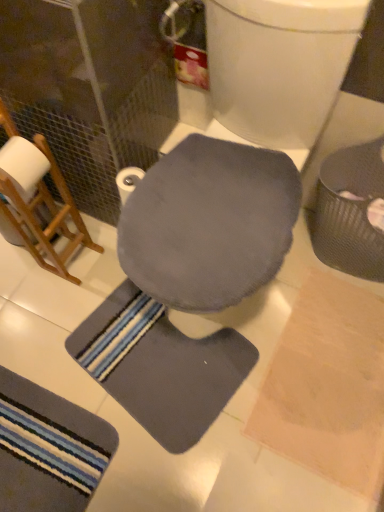
The height and width of the screenshot is (512, 384). What do you see at coordinates (111, 303) in the screenshot? I see `gray soft mat at center, which is the second bath mat from left to right` at bounding box center [111, 303].

What do you see at coordinates (49, 449) in the screenshot?
I see `striped fabric bath mat at lower left, acting as the first bath mat starting from the left` at bounding box center [49, 449].

Image resolution: width=384 pixels, height=512 pixels. Identify the location of gray soft mat at center, acting as the first bath mat starting from the right. (111, 303).

From a real-world perspective, relative to white matte toilet paper at center, is striped fabric bath mat at lower left, positioned as the second bath mat in right-to-left order, vertically above or below?

striped fabric bath mat at lower left, positioned as the second bath mat in right-to-left order, is situated lower than white matte toilet paper at center in the real world.

Does striped fabric bath mat at lower left, acting as the first bath mat starting from the left, appear on the right side of white matte toilet paper at center?

No, striped fabric bath mat at lower left, acting as the first bath mat starting from the left, is not to the right of white matte toilet paper at center.

In terms of width, does striped fabric bath mat at lower left, acting as the first bath mat starting from the left, look wider or thinner when compared to white matte toilet paper at center?

striped fabric bath mat at lower left, acting as the first bath mat starting from the left, is wider than white matte toilet paper at center.

Could you tell me if striped fabric bath mat at lower left, acting as the first bath mat starting from the left, is turned towards white matte toilet paper at center?

No, striped fabric bath mat at lower left, acting as the first bath mat starting from the left, is not oriented towards white matte toilet paper at center.

Does point (113, 389) come in front of point (122, 177)?

No, (113, 389) is further to viewer.

Does gray soft mat at center, which is the second bath mat from left to right, appear on the right side of white matte toilet paper at center?

Indeed, gray soft mat at center, which is the second bath mat from left to right, is positioned on the right side of white matte toilet paper at center.

Between gray soft mat at center, which is the second bath mat from left to right, and white matte toilet paper at center, which one is positioned in front?

white matte toilet paper at center is in front.

Is gray soft mat at center, which is the second bath mat from left to right, not near white matte toilet paper at center?

No, there isn't a large distance between gray soft mat at center, which is the second bath mat from left to right, and white matte toilet paper at center.

Relative to gray soft mat at center, acting as the first bath mat starting from the right, is striped fabric bath mat at lower left, acting as the first bath mat starting from the left, in front or behind?

In the image, striped fabric bath mat at lower left, acting as the first bath mat starting from the left, appears in front of gray soft mat at center, acting as the first bath mat starting from the right.

Is point (94, 474) farther from camera compared to point (158, 321)?

That is False.

Which is more to the left, striped fabric bath mat at lower left, acting as the first bath mat starting from the left, or gray soft mat at center, acting as the first bath mat starting from the right?

Positioned to the left is striped fabric bath mat at lower left, acting as the first bath mat starting from the left.

Looking at this image, from a real-world perspective, is striped fabric bath mat at lower left, positioned as the second bath mat in right-to-left order, above or below gray soft mat at center, which is the second bath mat from left to right?

In terms of real-world spatial position, striped fabric bath mat at lower left, positioned as the second bath mat in right-to-left order, is above gray soft mat at center, which is the second bath mat from left to right.

Is white matte toilet paper at center not inside matte gray swivel chair at center?

Absolutely, white matte toilet paper at center is external to matte gray swivel chair at center.

Considering the relative sizes of white matte toilet paper at center and matte gray swivel chair at center in the image provided, is white matte toilet paper at center wider than matte gray swivel chair at center?

Incorrect, the width of white matte toilet paper at center does not surpass that of matte gray swivel chair at center.

From a real-world perspective, between white matte toilet paper at center and matte gray swivel chair at center, who is vertically higher?

In real-world perspective, matte gray swivel chair at center is above.

What's the angular difference between white matte toilet paper at center and matte gray swivel chair at center's facing directions?

0.00062 degrees.

Considering the relative positions of matte gray swivel chair at center and gray soft mat at center, acting as the first bath mat starting from the right, in the image provided, is matte gray swivel chair at center to the right of gray soft mat at center, acting as the first bath mat starting from the right, from the viewer's perspective?

Indeed, matte gray swivel chair at center is positioned on the right side of gray soft mat at center, acting as the first bath mat starting from the right.

Is matte gray swivel chair at center looking in the opposite direction of gray soft mat at center, which is the second bath mat from left to right?

No, gray soft mat at center, which is the second bath mat from left to right, is not at the back of matte gray swivel chair at center.

How different are the orientations of matte gray swivel chair at center and gray soft mat at center, which is the second bath mat from left to right, in degrees?

17 degrees.

Looking at this image, is matte gray swivel chair at center positioned far away from gray soft mat at center, acting as the first bath mat starting from the right?

No, there isn't a large distance between matte gray swivel chair at center and gray soft mat at center, acting as the first bath mat starting from the right.

From a real-world perspective, which object rests below the other?

metallic textured trash can at right.

Is metallic textured trash can at right looking in the opposite direction of matte gray swivel chair at center?

No, metallic textured trash can at right is not facing the opposite direction of matte gray swivel chair at center.

Is point (360, 155) in front of point (226, 284)?

No, it is not.

Considering the relative positions of metallic textured trash can at right and matte gray swivel chair at center in the image provided, is metallic textured trash can at right behind matte gray swivel chair at center?

Yes, it is behind matte gray swivel chair at center.

Is metallic textured trash can at right inside the boundaries of gray soft mat at center, which is the second bath mat from left to right, or outside?

metallic textured trash can at right cannot be found inside gray soft mat at center, which is the second bath mat from left to right.

Is metallic textured trash can at right looking in the opposite direction of gray soft mat at center, acting as the first bath mat starting from the right?

No, metallic textured trash can at right is not facing the opposite direction of gray soft mat at center, acting as the first bath mat starting from the right.

In the image, is metallic textured trash can at right on the left side or the right side of gray soft mat at center, acting as the first bath mat starting from the right?

metallic textured trash can at right is positioned on gray soft mat at center, acting as the first bath mat starting from the right,'s right side.

From the image's perspective, between metallic textured trash can at right and gray soft mat at center, acting as the first bath mat starting from the right, who is located below?

gray soft mat at center, acting as the first bath mat starting from the right, is shown below in the image.

This screenshot has width=384, height=512. Find the location of `toilet paper above the striped fabric bath mat at lower left, acting as the first bath mat starting from the left (from the image's perspective)`. toilet paper above the striped fabric bath mat at lower left, acting as the first bath mat starting from the left (from the image's perspective) is located at coordinates (128, 181).

Find the location of a particular element. toilet paper above the gray soft mat at center, acting as the first bath mat starting from the right (from a real-world perspective) is located at coordinates (128, 181).

Looking at the image, which one is located further to white matte toilet paper at center, matte gray swivel chair at center or metallic textured trash can at right?

Among the two, metallic textured trash can at right is located further to white matte toilet paper at center.

Based on their spatial positions, is striped fabric bath mat at lower left, acting as the first bath mat starting from the left, or white matte toilet paper at center closer to gray soft mat at center, acting as the first bath mat starting from the right?

striped fabric bath mat at lower left, acting as the first bath mat starting from the left, lies closer to gray soft mat at center, acting as the first bath mat starting from the right, than the other object.

Based on their spatial positions, is matte gray swivel chair at center or gray soft mat at center, acting as the first bath mat starting from the right, further from striped fabric bath mat at lower left, acting as the first bath mat starting from the left?

Based on the image, matte gray swivel chair at center appears to be further to striped fabric bath mat at lower left, acting as the first bath mat starting from the left.

Which object lies nearer to the anchor point striped fabric bath mat at lower left, positioned as the second bath mat in right-to-left order, white matte toilet paper at center or gray soft mat at center, acting as the first bath mat starting from the right?

gray soft mat at center, acting as the first bath mat starting from the right.

Based on their spatial positions, is matte gray swivel chair at center or gray soft mat at center, which is the second bath mat from left to right, further from metallic textured trash can at right?

The object further to metallic textured trash can at right is gray soft mat at center, which is the second bath mat from left to right.

Considering their positions, is white matte toilet paper at center positioned further to gray soft mat at center, acting as the first bath mat starting from the right, than metallic textured trash can at right?

metallic textured trash can at right is positioned further to the anchor gray soft mat at center, acting as the first bath mat starting from the right.

When comparing their distances from white matte toilet paper at center, does metallic textured trash can at right or matte gray swivel chair at center seem closer?

Among the two, matte gray swivel chair at center is located nearer to white matte toilet paper at center.

When comparing their distances from white matte toilet paper at center, does gray soft mat at center, which is the second bath mat from left to right, or matte gray swivel chair at center seem further?

gray soft mat at center, which is the second bath mat from left to right.

Identify the location of swivel chair between white matte toilet paper at center and gray soft mat at center, acting as the first bath mat starting from the right, in the vertical direction. (209, 223).

Image resolution: width=384 pixels, height=512 pixels. Identify the location of swivel chair situated between white matte toilet paper at center and metallic textured trash can at right from left to right. (209, 223).

Locate an element on the screen. This screenshot has width=384, height=512. toilet paper between striped fabric bath mat at lower left, positioned as the second bath mat in right-to-left order, and metallic textured trash can at right is located at coordinates (128, 181).

At what (x,y) coordinates should I click in order to perform the action: click on swivel chair situated between gray soft mat at center, which is the second bath mat from left to right, and metallic textured trash can at right from left to right. Please return your answer as a coordinate pair (x, y). The width and height of the screenshot is (384, 512). Looking at the image, I should click on (209, 223).